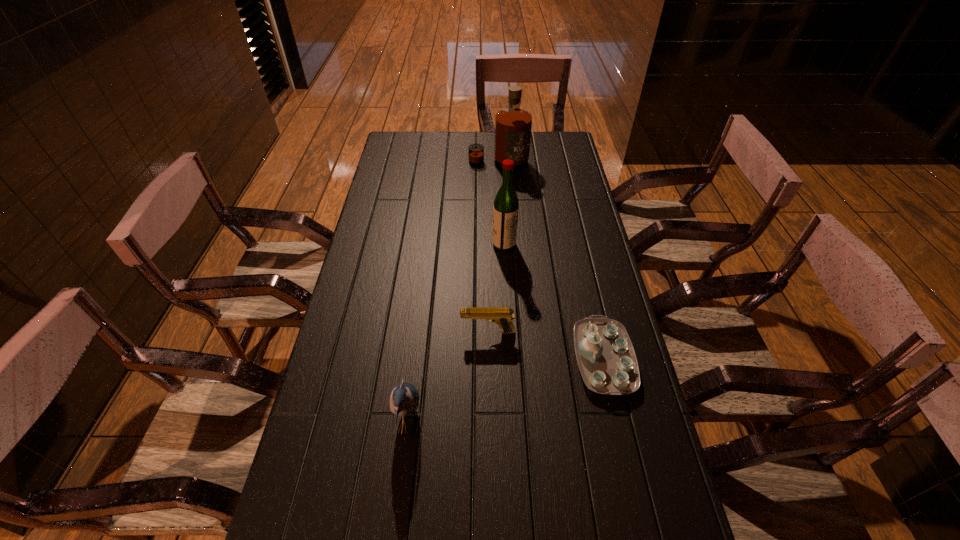
Locate an element on the screen. Image resolution: width=960 pixels, height=540 pixels. the farthest object is located at coordinates (513, 125).

Identify the location of the second farthest object. This screenshot has height=540, width=960. (506, 205).

Find the location of a particular element. the third shortest object is located at coordinates (404, 399).

In order to click on bird in this screenshot , I will do [x=404, y=399].

This screenshot has width=960, height=540. I want to click on the rightmost object, so click(606, 358).

Where is `pistol`? pistol is located at coordinates (502, 316).

This screenshot has height=540, width=960. I want to click on vacant space located on the front label of the farther liquor, so click(502, 233).

Where is `free spot located 0.350m on the label of the nearer liquor`? The width and height of the screenshot is (960, 540). free spot located 0.350m on the label of the nearer liquor is located at coordinates (389, 244).

At what (x,y) coordinates should I click in order to perform the action: click on free space located on the label of the nearer liquor. Please return your answer as a coordinate pair (x, y). The width and height of the screenshot is (960, 540). Looking at the image, I should click on (447, 244).

Identify the location of free space located 0.140m on the label of the nearer liquor. (451, 244).